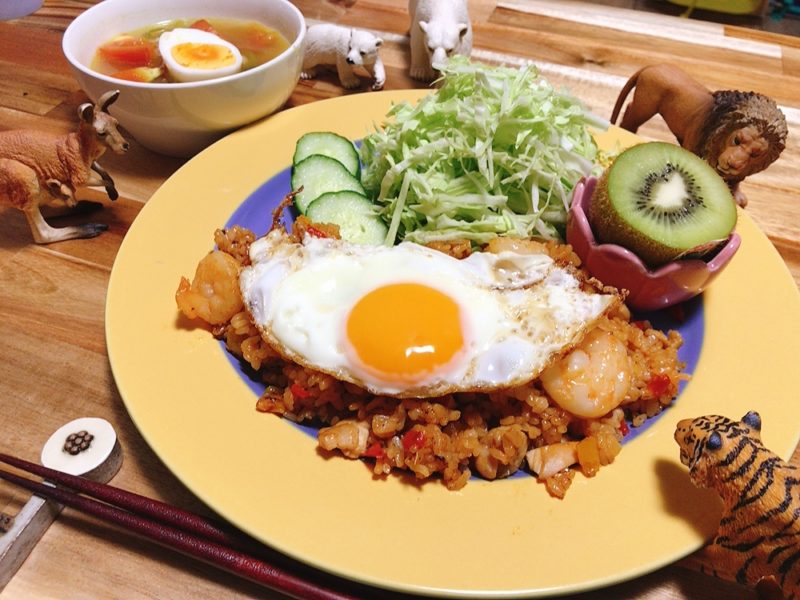
This screenshot has height=600, width=800. I want to click on chopsticks, so click(x=162, y=511), click(x=162, y=531).